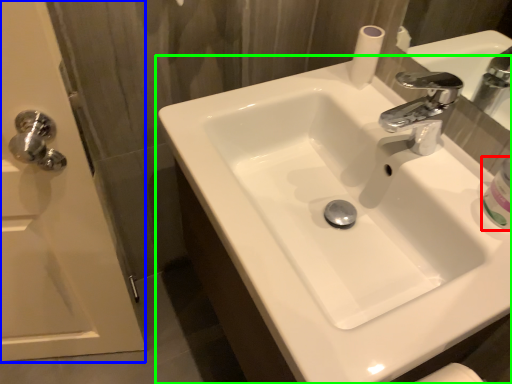
Question: Considering the real-world distances, which object is farthest from mouthwash (highlighted by a red box)? screen door (highlighted by a blue box) or sink (highlighted by a green box)?

Choices:
 (A) screen door
 (B) sink

Answer: (A)